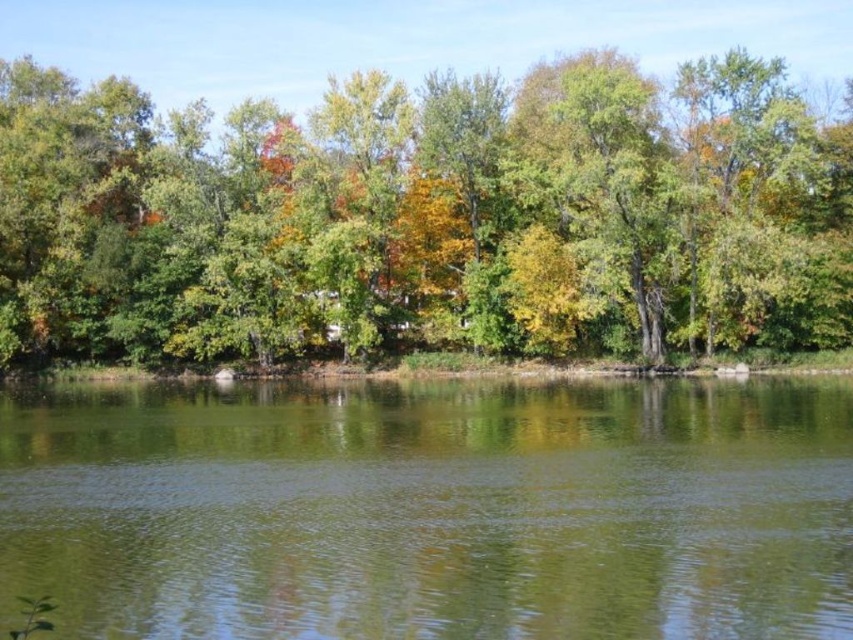
Which is in front, point (136, 216) or point (300, 483)?

Point (300, 483) is in front.

Is green matte tree at center bigger than green smooth water at center?

Yes.

At what (x,y) coordinates should I click in order to perform the action: click on green matte tree at center. Please return your answer as a coordinate pair (x, y). Looking at the image, I should click on (425, 218).

I want to click on green matte tree at center, so click(x=425, y=218).